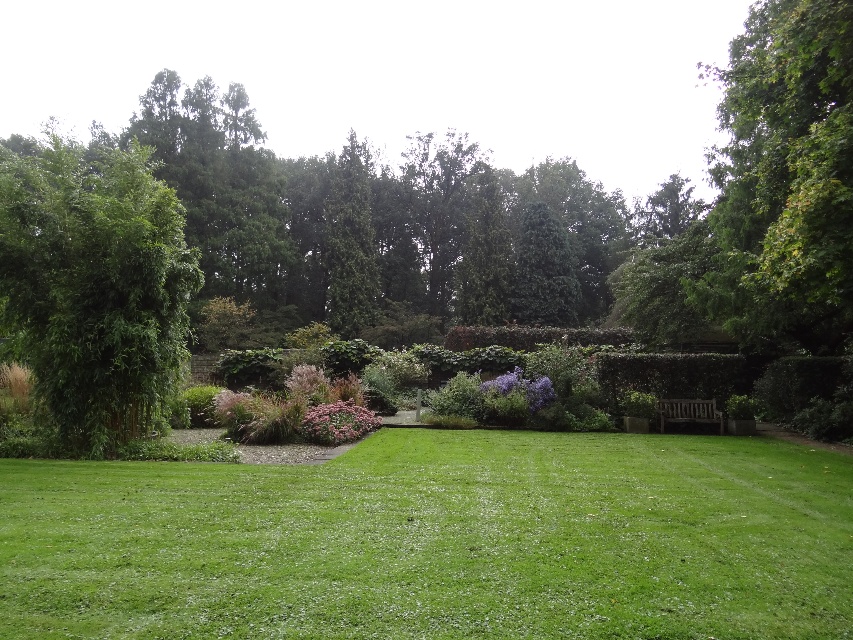
Who is taller, green grass at center or wooden bench at lower right?

wooden bench at lower right is taller.

Is point (9, 513) in front of point (711, 417)?

Yes, point (9, 513) is in front of point (711, 417).

Image resolution: width=853 pixels, height=640 pixels. Find the location of `green grass at center`. green grass at center is located at coordinates (437, 540).

Is green leafy tree at left to the right of pink matte flower at center from the viewer's perspective?

In fact, green leafy tree at left is to the left of pink matte flower at center.

Which is in front, point (137, 310) or point (329, 422)?

Point (137, 310) is more forward.

Identify the location of green leafy tree at left. This screenshot has width=853, height=640. (94, 285).

Is point (682, 630) positioned in front of point (343, 401)?

Yes.

Is point (672, 557) positioned before point (306, 436)?

Yes.

I want to click on green grass at center, so click(437, 540).